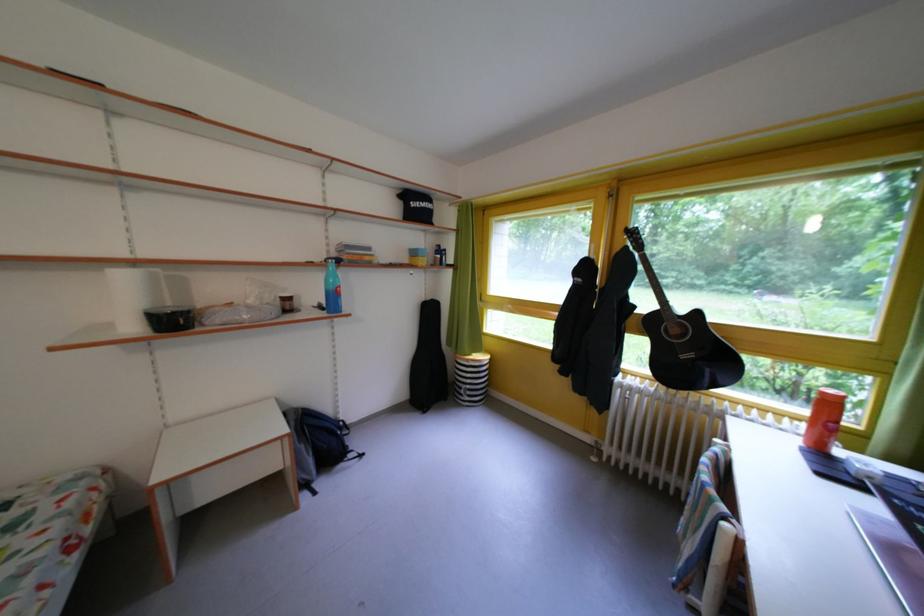
Describe the element at coordinates (823, 419) in the screenshot. I see `a red plastic bottle` at that location.